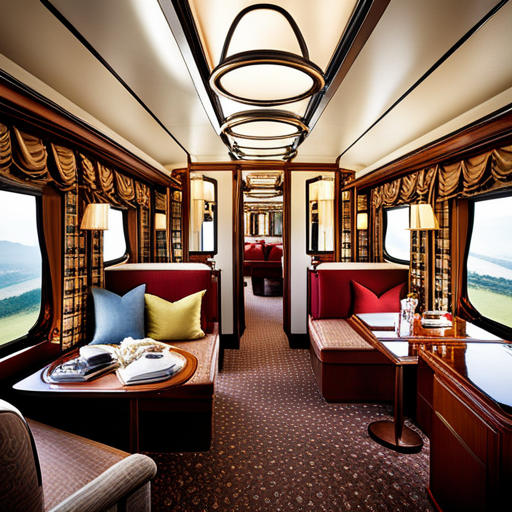
You are a GUI agent. You are given a task and a screenshot of the screen. Output one action in this format:
    pyautogui.click(x=<x>, y=<y>)
    Task: Click on the seats
    The height and width of the screenshot is (512, 512).
    Given the screenshot: What is the action you would take?
    pyautogui.click(x=329, y=337), pyautogui.click(x=201, y=344), pyautogui.click(x=76, y=460)